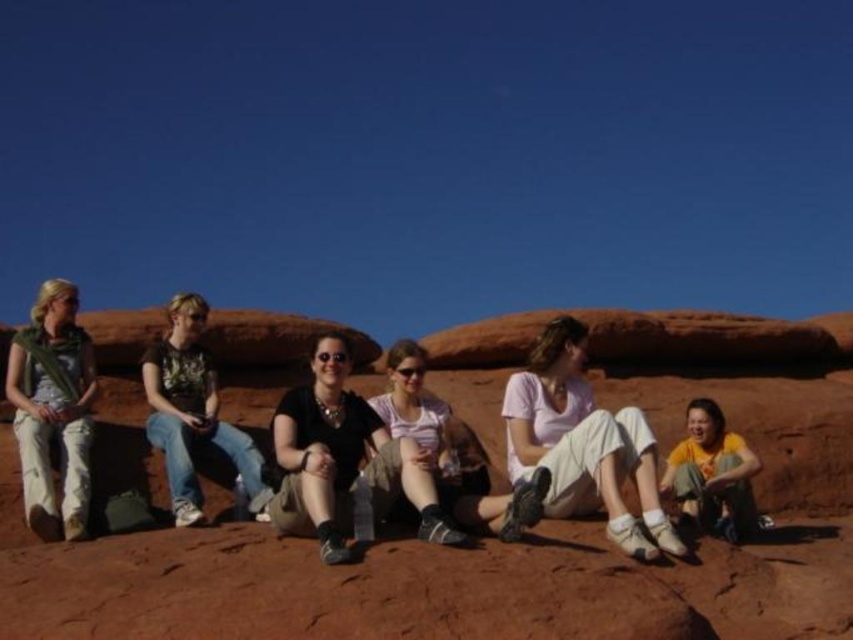
Is white cotton pants at center positioned behind matte pink shirt at center?

Yes, white cotton pants at center is behind matte pink shirt at center.

Who is higher up, white cotton pants at center or matte pink shirt at center?

matte pink shirt at center is higher up.

Between point (579, 500) and point (526, 522), which one is positioned behind?

Positioned behind is point (579, 500).

The width and height of the screenshot is (853, 640). Find the location of `white cotton pants at center`. white cotton pants at center is located at coordinates (583, 444).

Which is below, reddish-brown rock at center or white cotton pants at center?

Positioned lower is white cotton pants at center.

Can you confirm if reddish-brown rock at center is thinner than white cotton pants at center?

Incorrect, reddish-brown rock at center's width is not less than white cotton pants at center's.

At what (x,y) coordinates should I click in order to perform the action: click on reddish-brown rock at center. Please return your answer as a coordinate pair (x, y). This screenshot has width=853, height=640. Looking at the image, I should click on click(408, 586).

Is white cotton pants at center above matte black shirt at center?

Indeed, white cotton pants at center is positioned over matte black shirt at center.

Is white cotton pants at center smaller than matte black shirt at center?

Actually, white cotton pants at center might be larger than matte black shirt at center.

Locate an element on the screen. The width and height of the screenshot is (853, 640). white cotton pants at center is located at coordinates (583, 444).